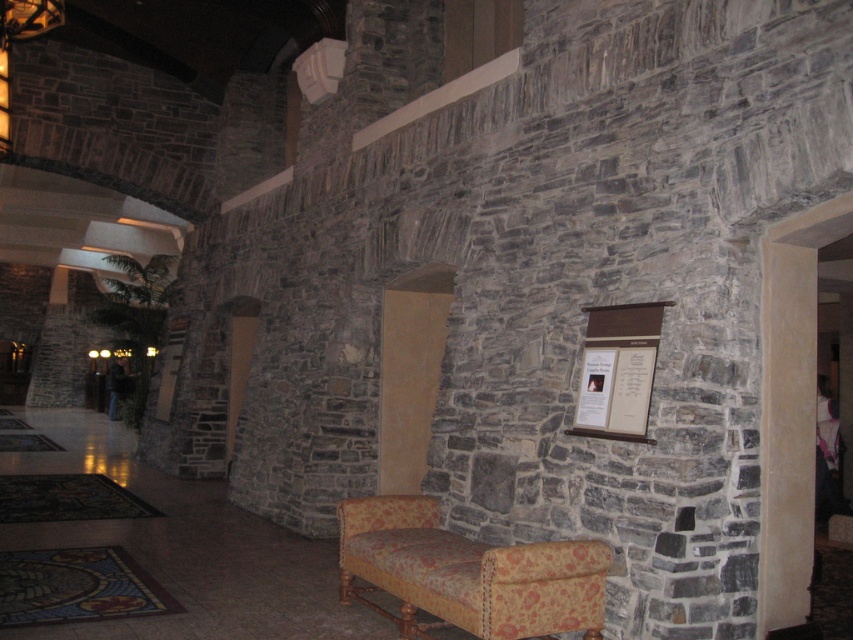
Question: Which point is closer to the camera?

Choices:
 (A) brown wood sign at center
 (B) floral-patterned fabric chaise lounge at center

Answer: (B)

Question: Which point is farther from the camera taking this photo?

Choices:
 (A) (358, 522)
 (B) (589, 408)

Answer: (A)

Question: From the image, what is the correct spatial relationship of floral-patterned fabric chaise lounge at center in relation to brown wood sign at center?

Choices:
 (A) right
 (B) left

Answer: (B)

Question: Among these points, which one is farthest from the camera?

Choices:
 (A) (537, 596)
 (B) (631, 353)

Answer: (B)

Question: Observing the image, what is the correct spatial positioning of floral-patterned fabric chaise lounge at center in reference to brown wood sign at center?

Choices:
 (A) left
 (B) right

Answer: (A)

Question: Is floral-patterned fabric chaise lounge at center closer to the viewer compared to brown wood sign at center?

Choices:
 (A) yes
 (B) no

Answer: (A)